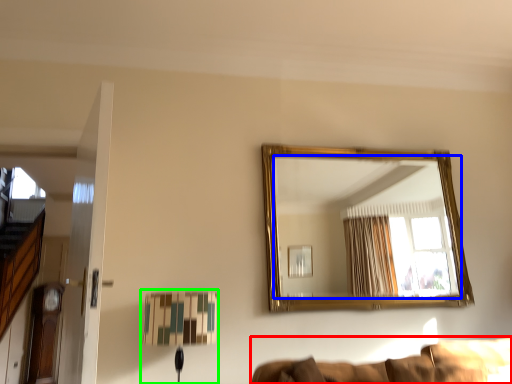
Question: Considering the real-world distances, which object is closest to couch (highlighted by a red box)? mirror (highlighted by a blue box) or table lamp (highlighted by a green box).

Choices:
 (A) mirror
 (B) table lamp

Answer: (B)